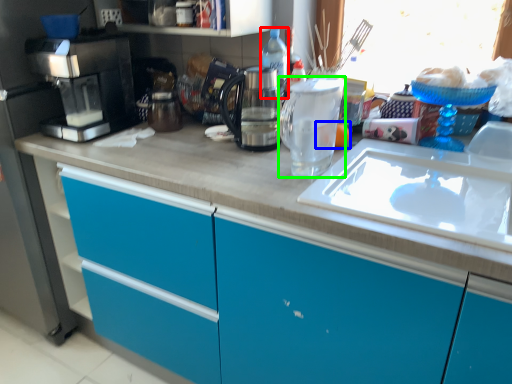
Question: Which is nearer to the bottle (highlighted by a red box)? food (highlighted by a blue box) or kitchen appliance (highlighted by a green box).

Choices:
 (A) food
 (B) kitchen appliance

Answer: (B)